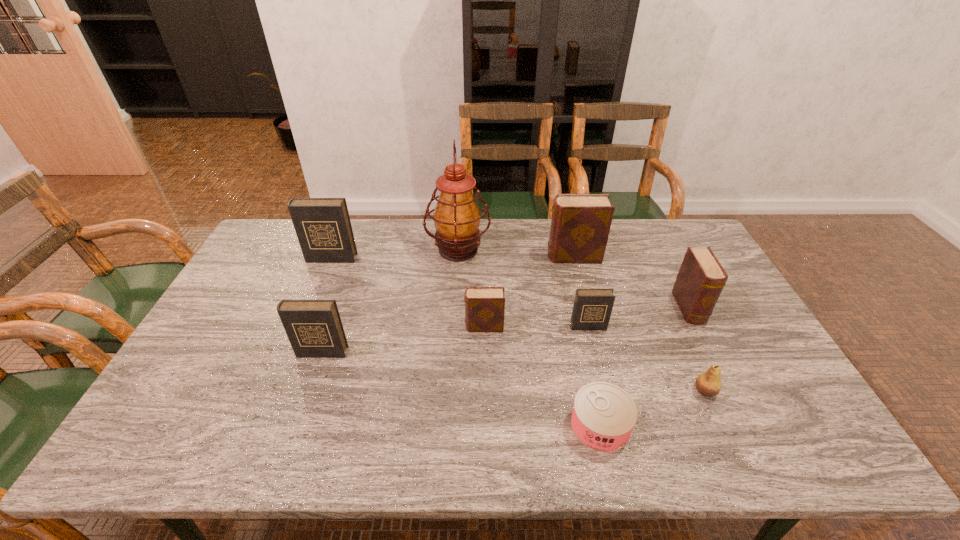
Locate an element on the screen. This screenshot has height=540, width=960. free spot between the biggest brown diary and the oil lamp is located at coordinates (516, 253).

This screenshot has width=960, height=540. Identify the location of free spot between the leftmost brown diary and the pear. (594, 359).

Find the location of a particular element. The image size is (960, 540). blank region between the second object from right to left and the seventh farthest object is located at coordinates (514, 372).

I want to click on free space between the rightmost object and the shortest object, so click(644, 367).

The image size is (960, 540). What are the coordinates of `vacant point located between the fourth diary from right to left and the biggest brown diary` in the screenshot? It's located at (529, 292).

In order to click on object that is the third closest to the can in this screenshot , I will do point(484,306).

Locate which object is the fourth closest to the fourth diary from right to left. Please provide its 2D coordinates. Your answer should be formatted as a tuple, i.e. [(x, y)], where the tuple contains the x and y coordinates of a point satisfying the conditions above.

[(580, 225)]

The height and width of the screenshot is (540, 960). I want to click on diary that stands as the fifth closest to the rightmost brown diary, so pyautogui.click(x=323, y=227).

The width and height of the screenshot is (960, 540). I want to click on diary that is the closest one to the farthest brown diary, so click(x=701, y=278).

Point out which brown diary is positioned as the second nearest to the nearest dark diary. Please provide its 2D coordinates. Your answer should be formatted as a tuple, i.e. [(x, y)], where the tuple contains the x and y coordinates of a point satisfying the conditions above.

[(580, 225)]